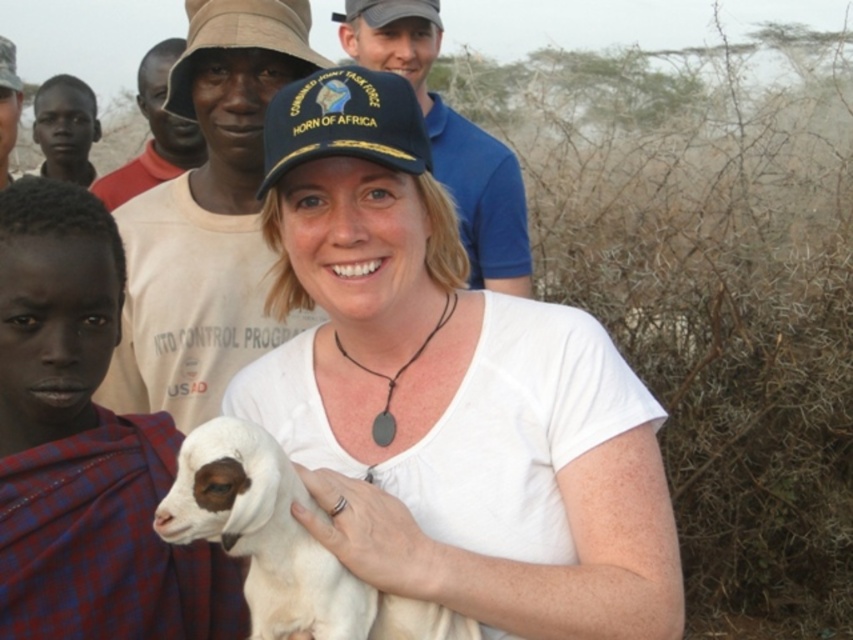
Does point (474, 637) lie in front of point (148, 163)?

Yes, it is in front of point (148, 163).

Can you confirm if white woolen lamb at center is smaller than tan cotton shirt at upper center?

Correct, white woolen lamb at center occupies less space than tan cotton shirt at upper center.

Is point (328, 589) farther from camera compared to point (167, 172)?

No, (328, 589) is closer to viewer.

Locate an element on the screen. The width and height of the screenshot is (853, 640). white woolen lamb at center is located at coordinates coord(282,544).

Does white matte shirt at center have a larger size compared to white woolen lamb at center?

Correct, white matte shirt at center is larger in size than white woolen lamb at center.

Describe the element at coordinates (447, 392) in the screenshot. Image resolution: width=853 pixels, height=640 pixels. I see `white matte shirt at center` at that location.

This screenshot has height=640, width=853. In order to click on white matte shirt at center in this screenshot , I will do `click(447, 392)`.

Is point (428, 326) farther from viewer compared to point (142, 108)?

No, it is in front of (142, 108).

Between white matte shirt at center and tan cotton shirt at upper center, which one is positioned higher?

tan cotton shirt at upper center

The image size is (853, 640). I want to click on white matte shirt at center, so click(x=447, y=392).

Where is `white matte shirt at center`? white matte shirt at center is located at coordinates (447, 392).